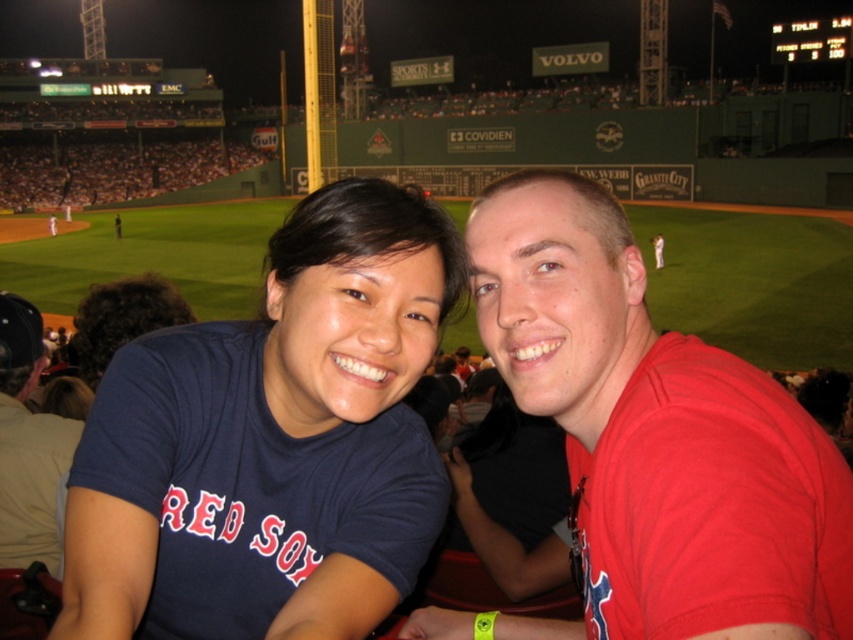
Is point (798, 586) farther from camera compared to point (660, 246)?

No, (798, 586) is in front of (660, 246).

Is red matte shirt at center positioned at the back of red matte baseball glove at center?

That is False.

Which is in front, point (515, 262) or point (654, 244)?

Point (515, 262) is in front.

The height and width of the screenshot is (640, 853). Find the location of `red matte shirt at center`. red matte shirt at center is located at coordinates pyautogui.click(x=651, y=440).

Between navy blue t-shirt at center and red matte shirt at center, which one is positioned higher?

red matte shirt at center is higher up.

Between point (141, 381) and point (668, 540), which one is positioned behind?

Point (141, 381)

Where is `navy blue t-shirt at center`? navy blue t-shirt at center is located at coordinates (271, 442).

Can you confirm if matte blue shirt at center is positioned to the left of red matte baseball glove at center?

Correct, you'll find matte blue shirt at center to the left of red matte baseball glove at center.

Does matte blue shirt at center appear under red matte baseball glove at center?

Yes, matte blue shirt at center is below red matte baseball glove at center.

Is point (4, 410) positioned before point (660, 262)?

Yes.

Find the location of a particular element. This screenshot has height=640, width=853. matte blue shirt at center is located at coordinates (28, 444).